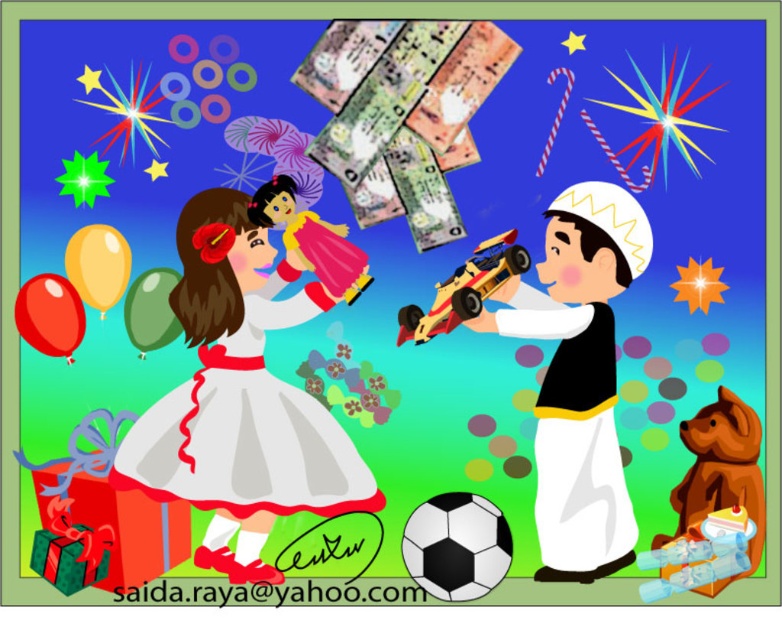
Question: Is yellow matte toy car at center to the left of yellow matte balloon at lower left from the viewer's perspective?

Choices:
 (A) yes
 (B) no

Answer: (B)

Question: Which of these objects is positioned closest to the smooth plastic toy car at center?

Choices:
 (A) yellow matte balloon at lower left
 (B) yellow matte toy car at center
 (C) green matte balloon at left

Answer: (B)

Question: Which point is closer to the camera?

Choices:
 (A) green matte balloon at left
 (B) yellow matte balloon at lower left

Answer: (B)

Question: Which point appears closest to the camera in this image?

Choices:
 (A) (702, 582)
 (B) (42, 278)
 (C) (482, 586)

Answer: (A)

Question: Is matte white dress at center below yellow matte balloon at lower left?

Choices:
 (A) yes
 (B) no

Answer: (A)

Question: Is brown plush bear at lower right above yellow matte balloon at lower left?

Choices:
 (A) yes
 (B) no

Answer: (B)